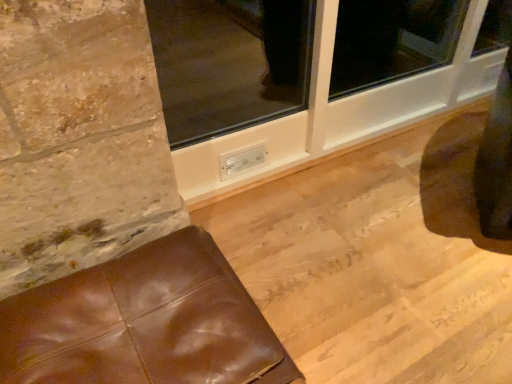
This screenshot has height=384, width=512. I want to click on vacant region above brown leather ottoman at lower left (from a real-world perspective), so click(x=84, y=302).